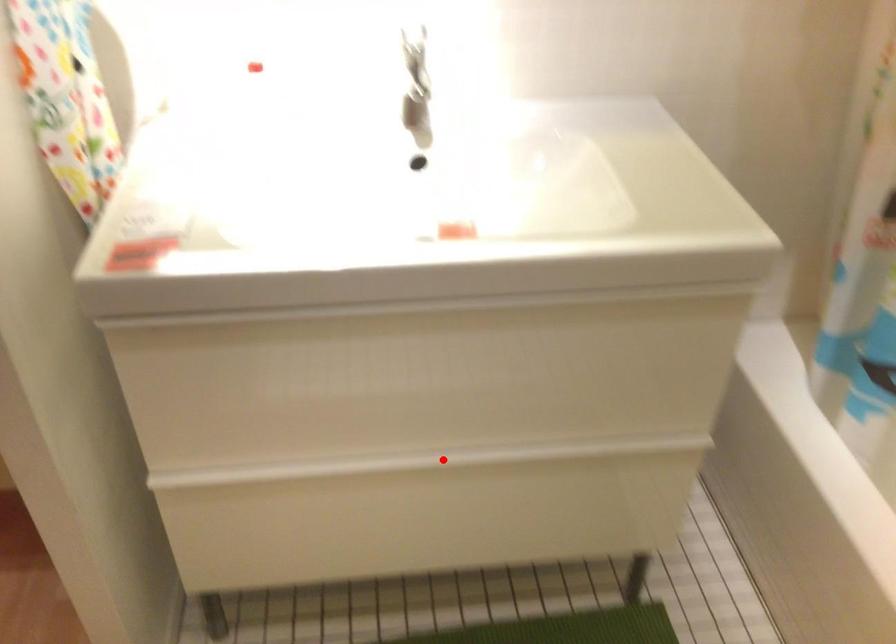
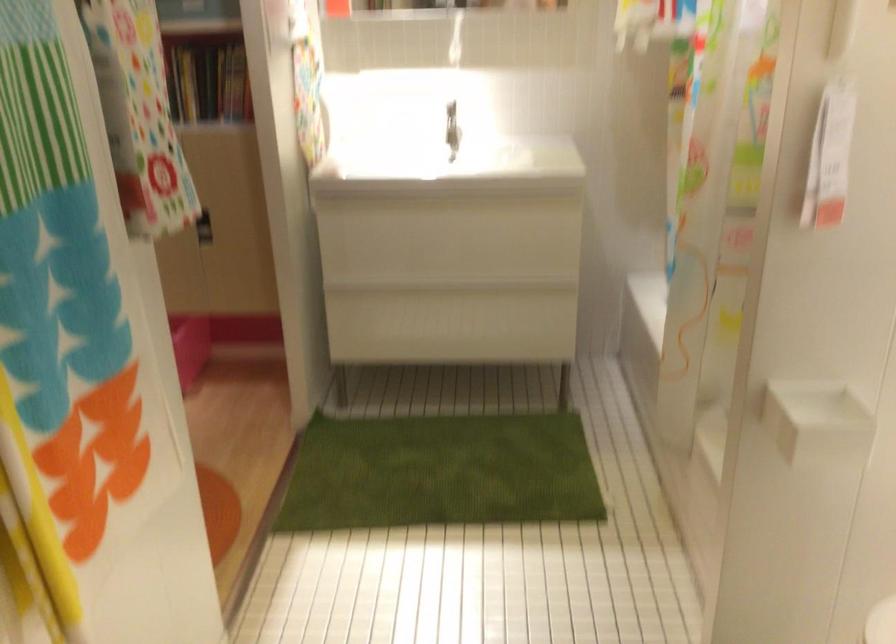
Where in the second image is the point corresponding to the highlighted location from the first image?

(453, 288)